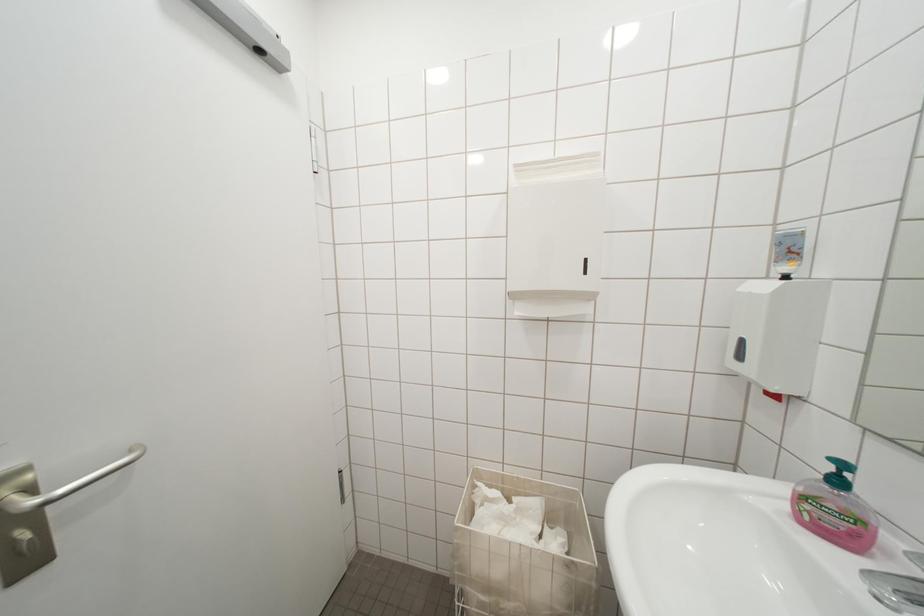
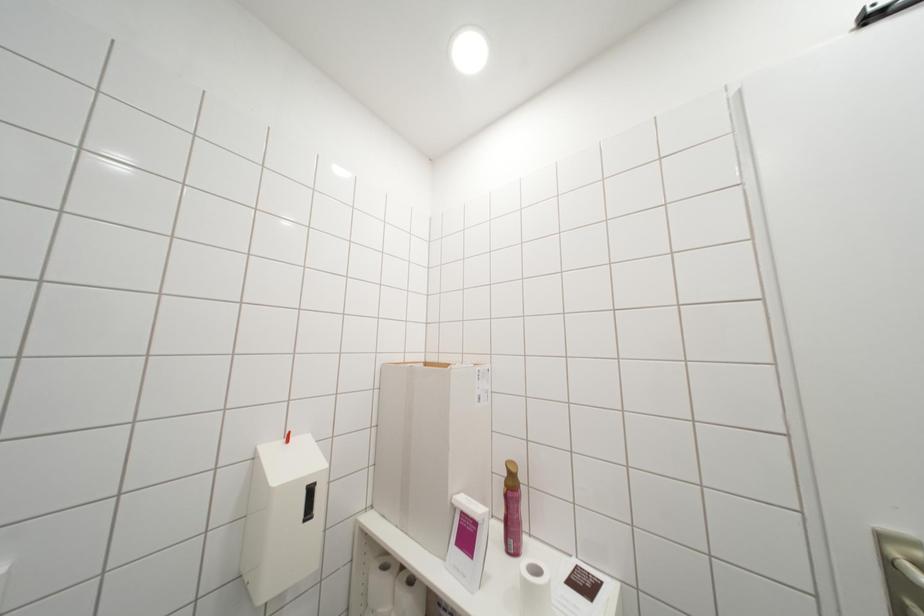
Question: How did the camera likely rotate?

Choices:
 (A) Left
 (B) Right
 (C) Up
 (D) Down

Answer: (A)